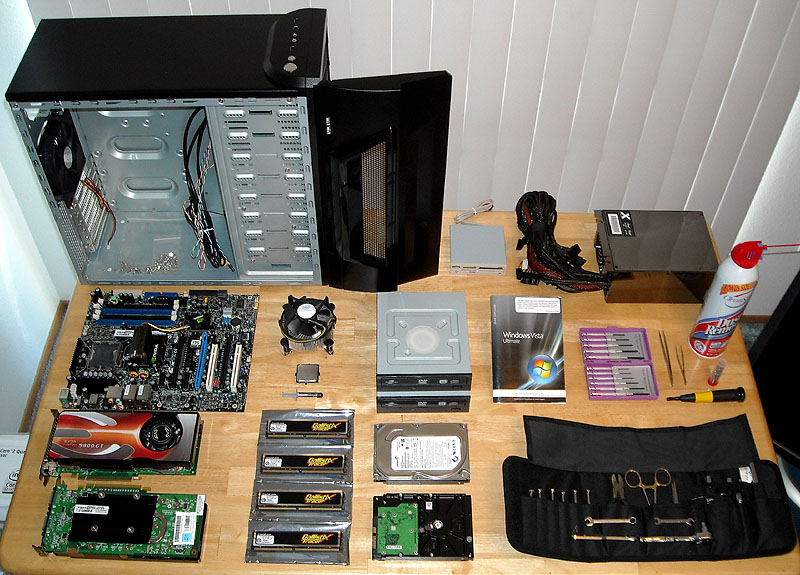
Find the location of a particular element. pc case is located at coordinates (174, 60).